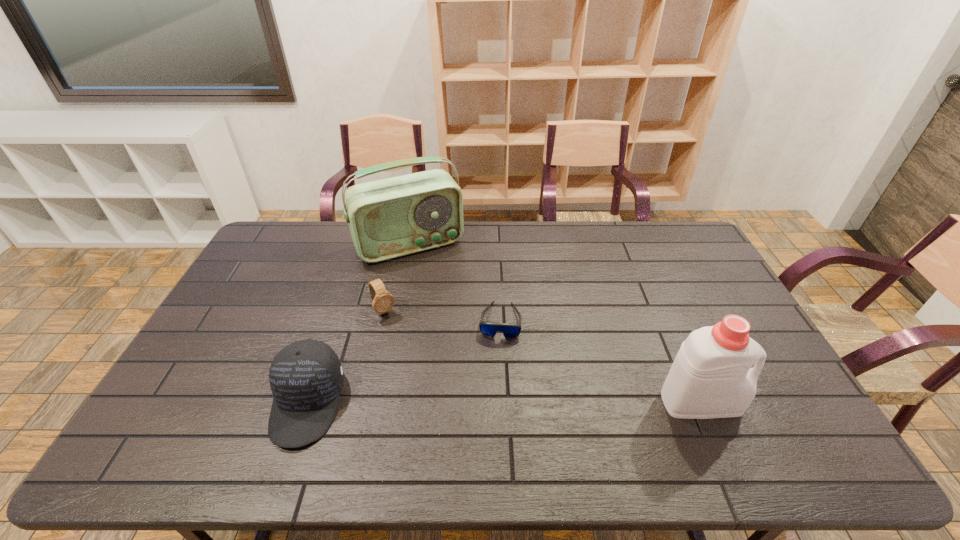
Where is `vacant space on the desktop that is between the third tallest object and the rightmost object and is positioned on the front-facing side of the sunglasses`? vacant space on the desktop that is between the third tallest object and the rightmost object and is positioned on the front-facing side of the sunglasses is located at coordinates (492, 403).

At what (x,y) coordinates should I click in order to perform the action: click on vacant space on the desktop that is between the third tallest object and the detergent and is positioned on the front panel of the radio receiver. Please return your answer as a coordinate pair (x, y). Looking at the image, I should click on (491, 403).

This screenshot has width=960, height=540. In order to click on vacant space on the desktop that is between the third shortest object and the rightmost object and is positioned on the face of the watch in this screenshot , I will do `click(447, 403)`.